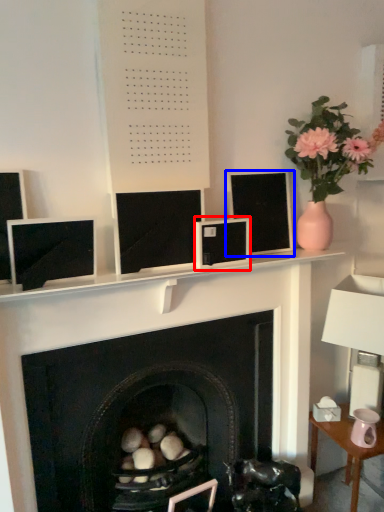
Question: Which point is closer to the camera, computer monitor (highlighted by a red box) or computer monitor (highlighted by a blue box)?

Choices:
 (A) computer monitor
 (B) computer monitor

Answer: (A)